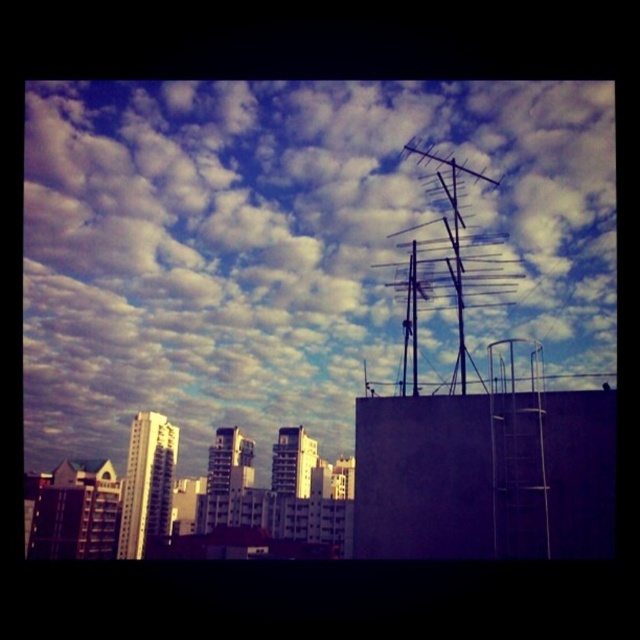
Question: Is cloudy sky at upper center below metallic antenna at upper right?

Choices:
 (A) yes
 (B) no

Answer: (B)

Question: Among these points, which one is nearest to the camera?

Choices:
 (A) (444, 381)
 (B) (580, 296)

Answer: (A)

Question: Is cloudy sky at upper center closer to the viewer compared to metallic antenna at upper right?

Choices:
 (A) no
 (B) yes

Answer: (A)

Question: Does cloudy sky at upper center lie behind metallic antenna at upper right?

Choices:
 (A) no
 (B) yes

Answer: (B)